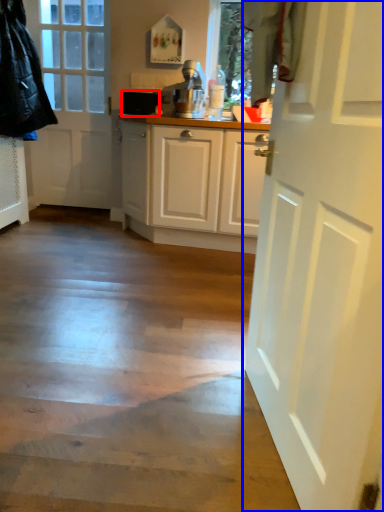
Question: Which object is further to the camera taking this photo, appliance (highlighted by a red box) or door (highlighted by a blue box)?

Choices:
 (A) appliance
 (B) door

Answer: (A)